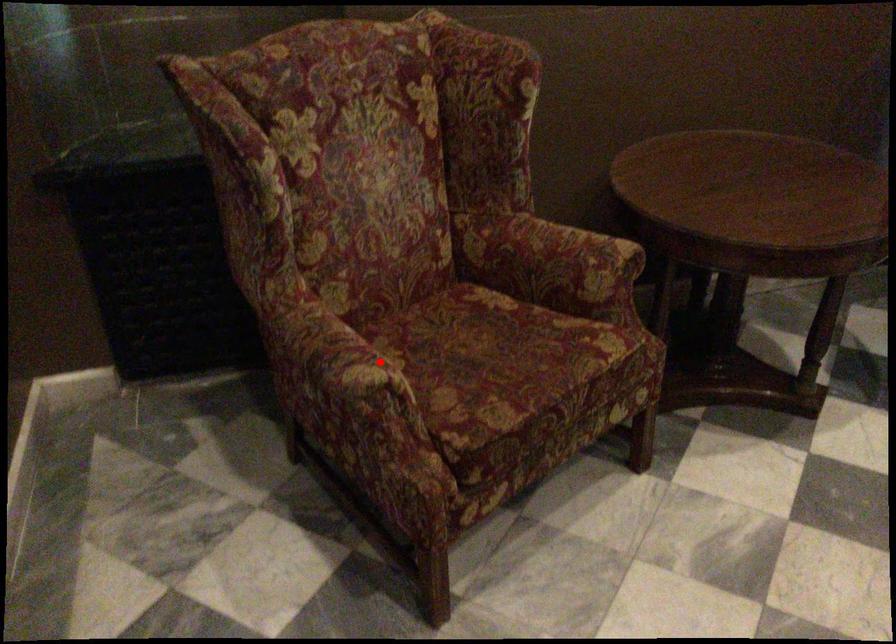
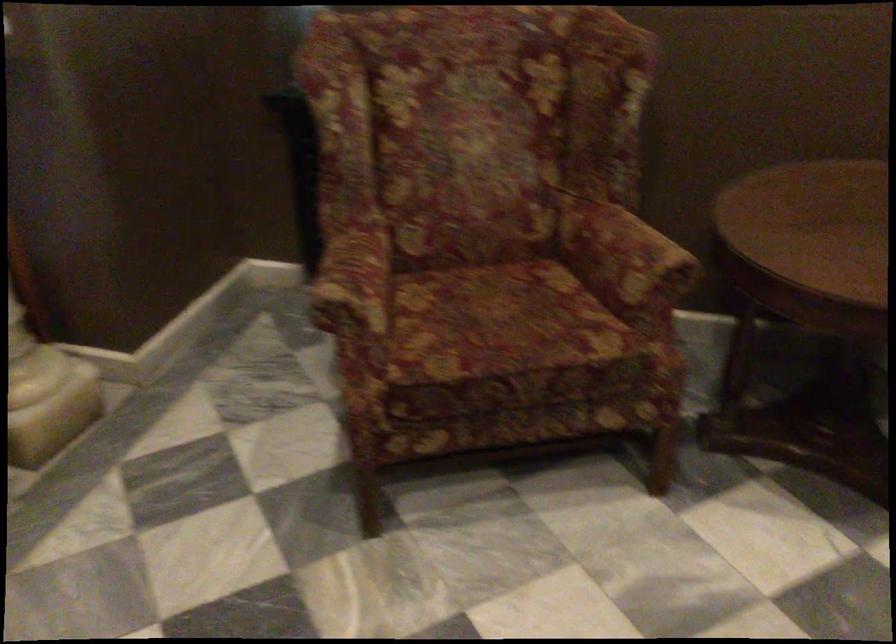
Find the pixel in the second image that matches the highlighted location in the first image.

(355, 286)